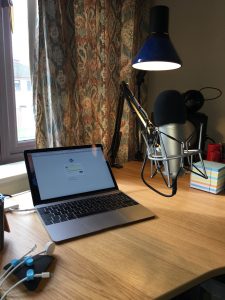
This screenshot has width=225, height=300. I want to click on cable holder, so click(x=37, y=265).